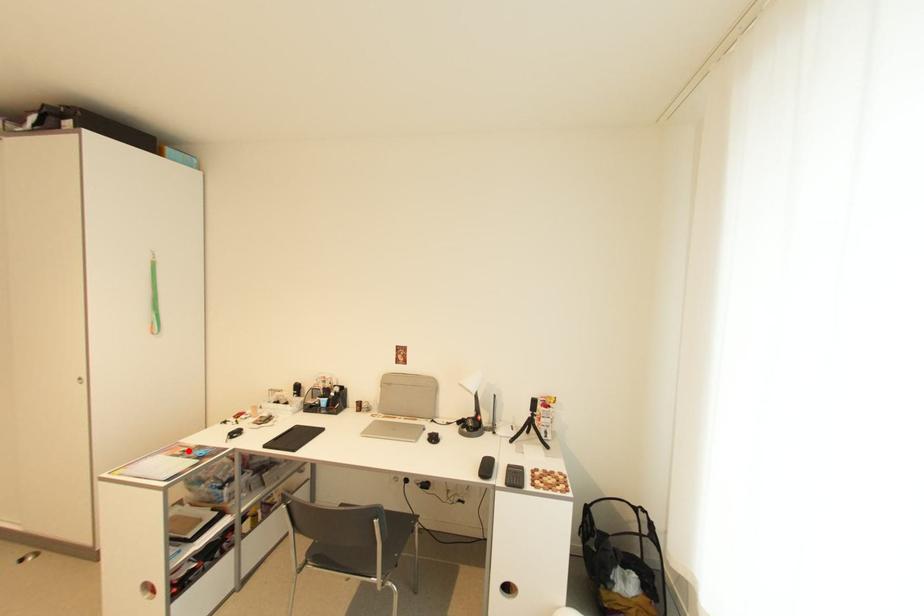
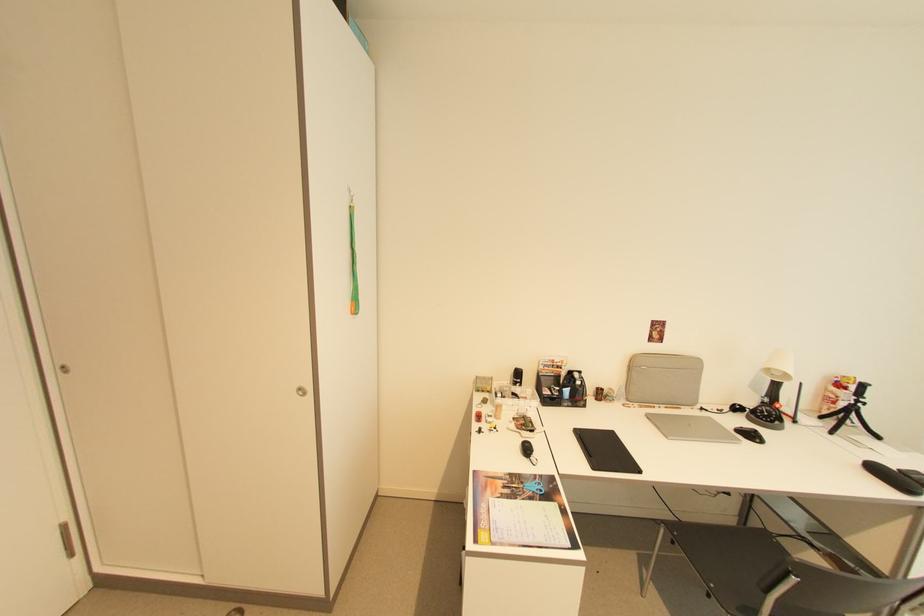
In the second image, find the point that corresponds to the highlighted location in the first image.

(505, 484)